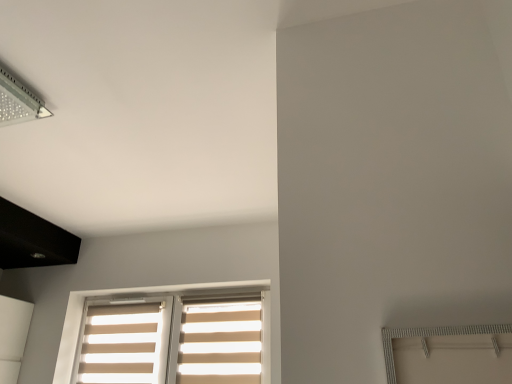
Question: Is beige fabric curtain at lower left, placed as the 1th curtain when sorted from left to right, thinner than transparent plastic lamp at upper left?

Choices:
 (A) no
 (B) yes

Answer: (B)

Question: Can you confirm if beige fabric curtain at lower left, marked as the 2th curtain in a right-to-left arrangement, is shorter than transparent plastic lamp at upper left?

Choices:
 (A) yes
 (B) no

Answer: (B)

Question: Are beige fabric curtain at lower left, marked as the 2th curtain in a right-to-left arrangement, and transparent plastic lamp at upper left far apart?

Choices:
 (A) yes
 (B) no

Answer: (A)

Question: Does beige fabric curtain at lower left, marked as the 2th curtain in a right-to-left arrangement, have a greater width compared to transparent plastic lamp at upper left?

Choices:
 (A) no
 (B) yes

Answer: (A)

Question: Is the surface of beige fabric curtain at lower left, marked as the 2th curtain in a right-to-left arrangement, in direct contact with transparent plastic lamp at upper left?

Choices:
 (A) no
 (B) yes

Answer: (A)

Question: Looking at their shapes, would you say beige fabric blinds at lower center is wider or thinner than transparent plastic lamp at upper left?

Choices:
 (A) wide
 (B) thin

Answer: (B)

Question: In terms of size, does beige fabric blinds at lower center appear bigger or smaller than transparent plastic lamp at upper left?

Choices:
 (A) small
 (B) big

Answer: (B)

Question: Relative to transparent plastic lamp at upper left, is beige fabric blinds at lower center in front or behind?

Choices:
 (A) behind
 (B) front

Answer: (A)

Question: In terms of height, does beige fabric blinds at lower center look taller or shorter compared to transparent plastic lamp at upper left?

Choices:
 (A) short
 (B) tall

Answer: (B)

Question: Visually, is beige fabric blinds at lower center positioned to the left or to the right of beige fabric curtain at lower left, placed as the 1th curtain when sorted from left to right?

Choices:
 (A) right
 (B) left

Answer: (A)

Question: Do you think beige fabric blinds at lower center is within beige fabric curtain at lower left, placed as the 1th curtain when sorted from left to right, or outside of it?

Choices:
 (A) inside
 (B) outside

Answer: (B)

Question: From a real-world perspective, is beige fabric blinds at lower center physically located above or below beige fabric curtain at lower left, placed as the 1th curtain when sorted from left to right?

Choices:
 (A) below
 (B) above

Answer: (B)

Question: From the image's perspective, is beige fabric blinds at lower center positioned above or below beige fabric curtain at lower left, marked as the 2th curtain in a right-to-left arrangement?

Choices:
 (A) below
 (B) above

Answer: (B)

Question: Is transparent plastic lamp at upper left to the left or to the right of beige fabric blinds at lower center in the image?

Choices:
 (A) right
 (B) left

Answer: (B)

Question: Is point (3, 115) positioned closer to the camera than point (266, 357)?

Choices:
 (A) closer
 (B) farther

Answer: (A)